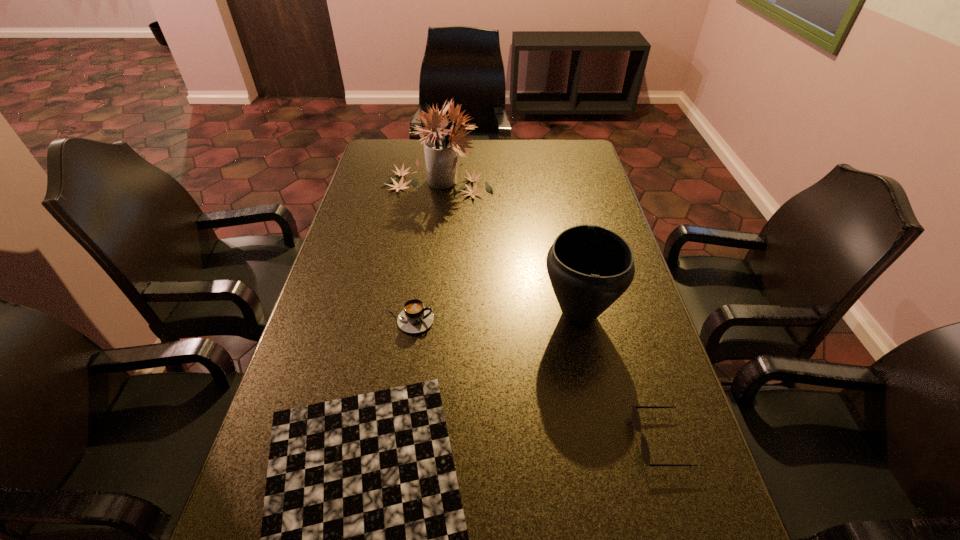
You are a GUI agent. You are given a task and a screenshot of the screen. Output one action in this format:
    pyautogui.click(x=<x>, y=<y>)
    Task: Click on the vacant space that satisfies the following two spatial constraints: 1. on the front side of the bouquet; 2. on the right side of the fourth shortest object
    
    Given the screenshot: What is the action you would take?
    pyautogui.click(x=420, y=314)